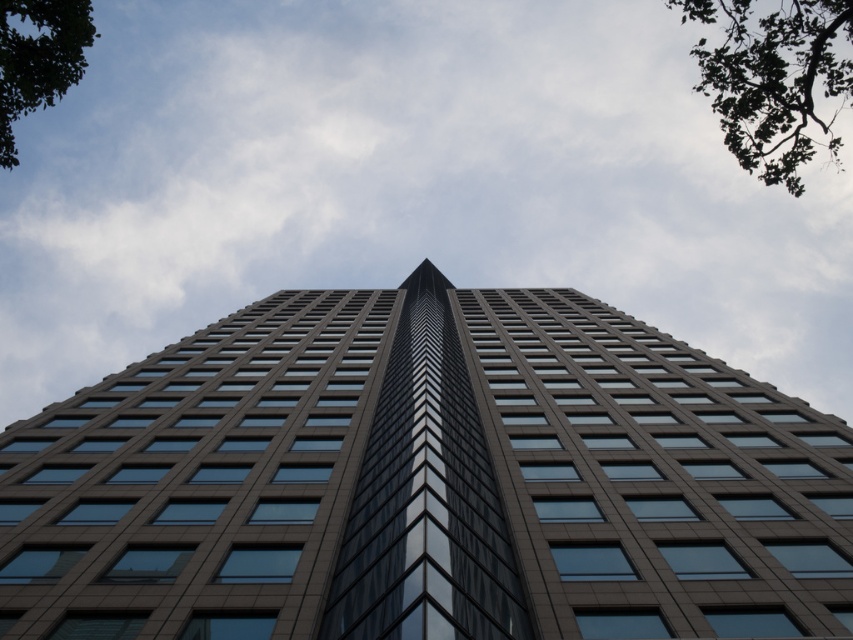
The height and width of the screenshot is (640, 853). Describe the element at coordinates (775, 80) in the screenshot. I see `green leafy tree at upper right` at that location.

Does green leafy tree at upper right have a smaller size compared to green leafy tree at upper left?

Actually, green leafy tree at upper right might be larger than green leafy tree at upper left.

Does point (786, 168) come farther from viewer compared to point (93, 28)?

Yes, it is.

Find the location of `green leafy tree at upper right`. green leafy tree at upper right is located at coordinates (775, 80).

The height and width of the screenshot is (640, 853). What do you see at coordinates (426, 481) in the screenshot? I see `smooth glass tower at center` at bounding box center [426, 481].

Does smooth glass tower at center have a lesser height compared to green leafy tree at upper left?

Yes, smooth glass tower at center is shorter than green leafy tree at upper left.

Locate an element on the screen. The height and width of the screenshot is (640, 853). smooth glass tower at center is located at coordinates (426, 481).

This screenshot has height=640, width=853. Identify the location of smooth glass tower at center. (426, 481).

Can you confirm if smooth glass tower at center is positioned to the right of green leafy tree at upper right?

No, smooth glass tower at center is not to the right of green leafy tree at upper right.

Can you confirm if smooth glass tower at center is positioned to the left of green leafy tree at upper right?

Indeed, smooth glass tower at center is positioned on the left side of green leafy tree at upper right.

What are the coordinates of `smooth glass tower at center` in the screenshot? It's located at (426, 481).

Locate an element on the screen. This screenshot has width=853, height=640. smooth glass tower at center is located at coordinates (426, 481).